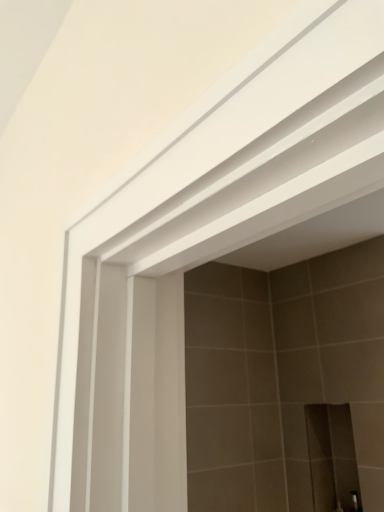
What do you see at coordinates (354, 502) in the screenshot? This screenshot has height=512, width=384. I see `matte white pipe at lower right` at bounding box center [354, 502].

You are a GUI agent. You are given a task and a screenshot of the screen. Output one action in this format:
    pyautogui.click(x=<x>, y=<y>)
    Task: Click on the matte white pipe at lower right
    Image resolution: width=384 pixels, height=512 pixels.
    Given the screenshot: What is the action you would take?
    pyautogui.click(x=354, y=502)

You are a GUI agent. You are given a task and a screenshot of the screen. Output one action in this format:
    pyautogui.click(x=<x>, y=<y>)
    Task: Click on the matte white pipe at lower right
    The image size is (384, 512).
    Given the screenshot: What is the action you would take?
    pyautogui.click(x=354, y=502)